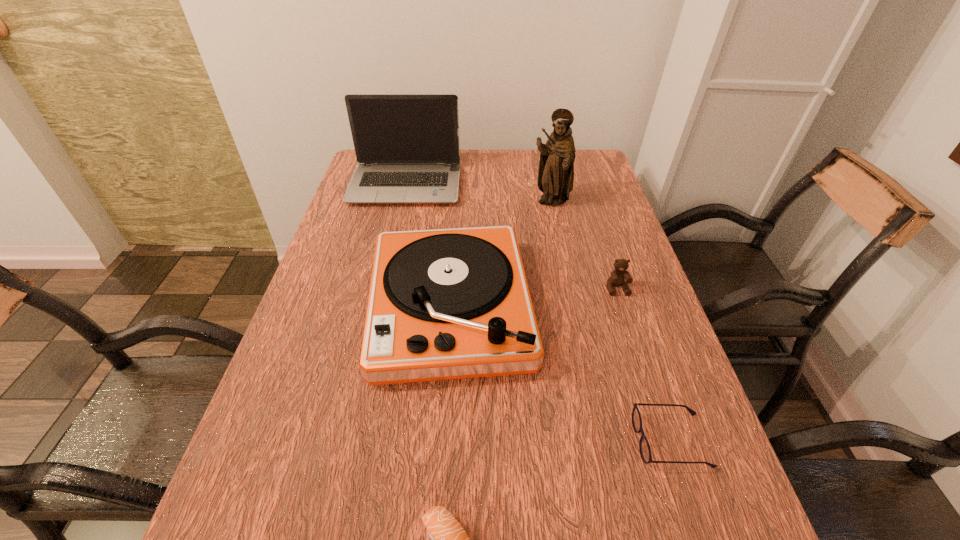
Find the location of `vacant region at the left edge`. vacant region at the left edge is located at coordinates click(286, 361).

The image size is (960, 540). What are the coordinates of `free space at the right edge of the desktop` in the screenshot? It's located at (639, 271).

Locate an element on the screen. The width and height of the screenshot is (960, 540). free space between the figurine and the laptop computer is located at coordinates (478, 194).

Where is `free spot between the third tallest object and the teddy bear`? The image size is (960, 540). free spot between the third tallest object and the teddy bear is located at coordinates (534, 298).

At what (x,y) coordinates should I click in order to perform the action: click on vacant space that is in between the figurine and the laptop computer. Please return your answer as a coordinate pair (x, y). The width and height of the screenshot is (960, 540). Looking at the image, I should click on (478, 194).

Where is `vacant area that lies between the spectacles and the fourth object from left to right`? vacant area that lies between the spectacles and the fourth object from left to right is located at coordinates (611, 322).

You are a GUI agent. You are given a task and a screenshot of the screen. Output one action in this format:
    pyautogui.click(x=<x>, y=<y>)
    Task: Click on the free space between the fourth object from left to right and the laptop computer
    
    Given the screenshot: What is the action you would take?
    pyautogui.click(x=478, y=194)

Find the location of a particular element. The height and width of the screenshot is (540, 960). object that stands as the second closest to the teddy bear is located at coordinates (556, 165).

Locate an element on the screen. The height and width of the screenshot is (540, 960). object that stands as the second closest to the laptop computer is located at coordinates (556, 165).